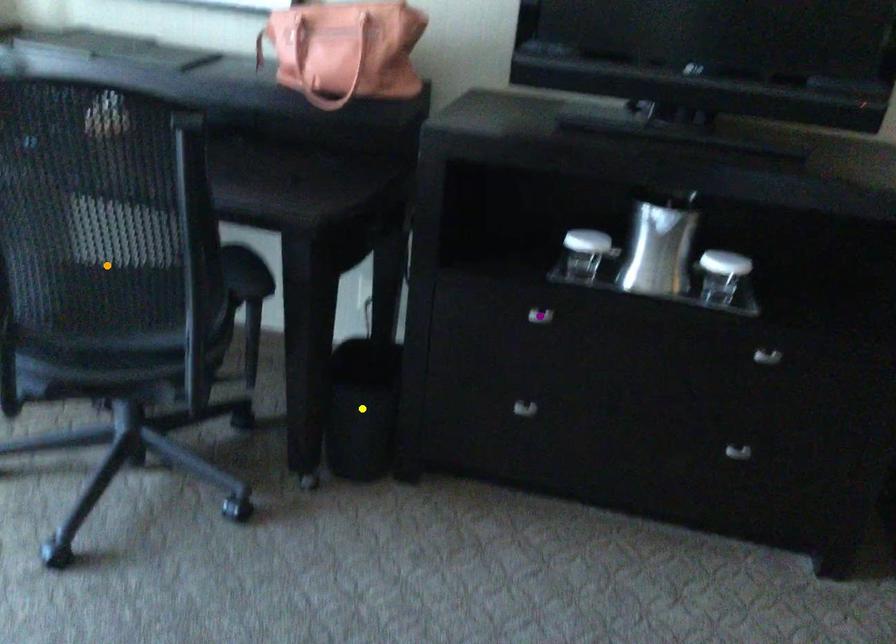
Order these from farthest to nearest:
orange point, yellow point, purple point

yellow point → purple point → orange point